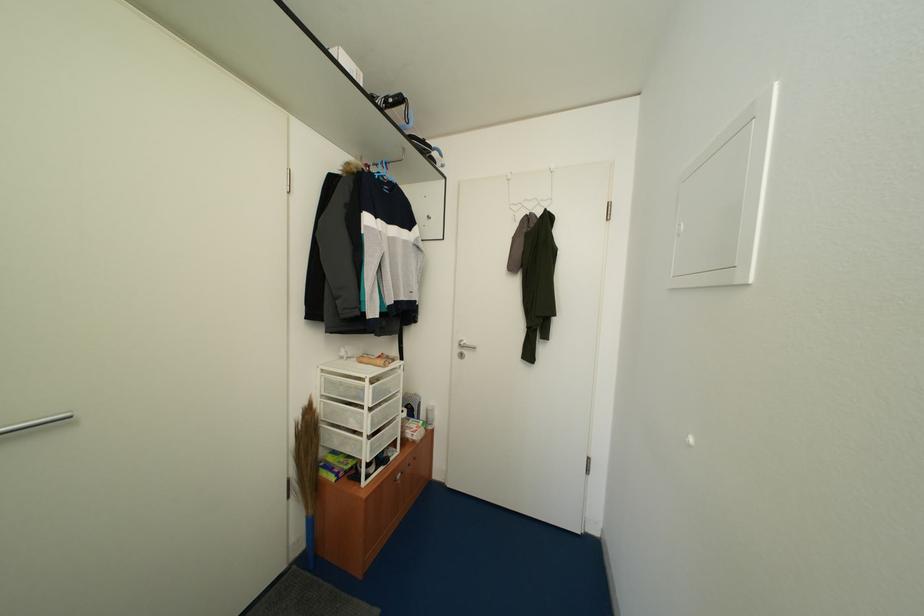
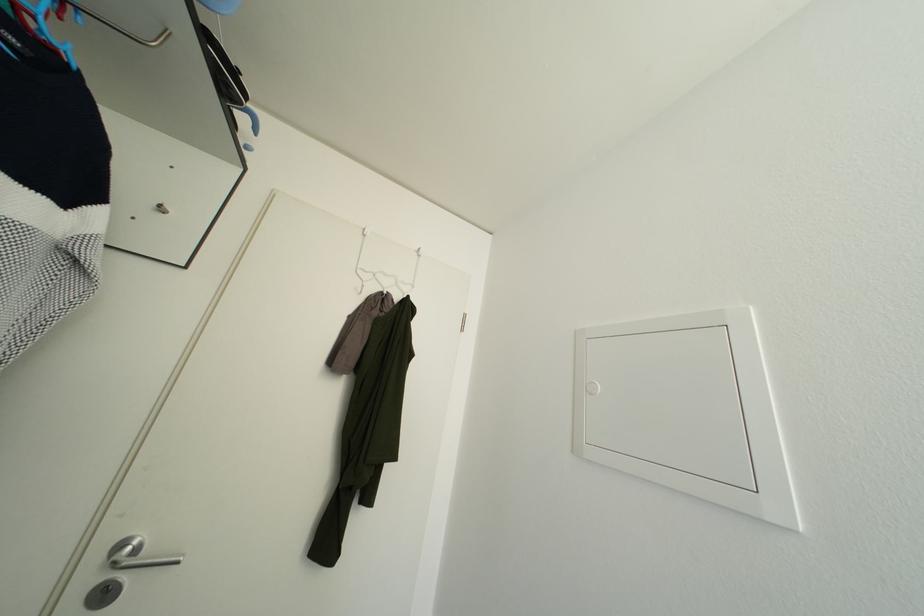
Find the pixel in the second image that matches pixel 518 211 in the first image.

(366, 277)